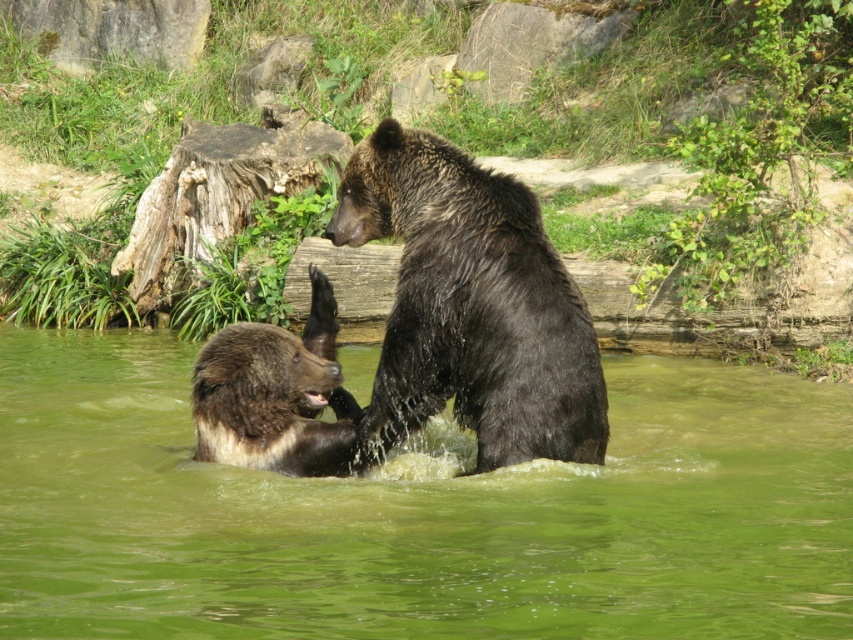
You are a wildlife photographer trying to capture the interaction between the two brown bears in the image. To ensure the bears are centered in your shot, you need to adjust your camera to focus on the green water at center. What coordinate should you set your camera focus point to?

The green water at center is located at coordinate point (419, 513). Therefore, you should set your camera focus point to coordinate (419, 513) to ensure the bears are centered in your shot.

You are a photographer trying to capture a clear shot of both the green water at center and the brown furry bear at center. Based on their sizes, which one should you focus on to ensure it fits entirely within your camera frame?

The green water at center might be wider than brown furry bear at center, so focusing on the green water at center would ensure it fits entirely within the camera frame since it is wider.